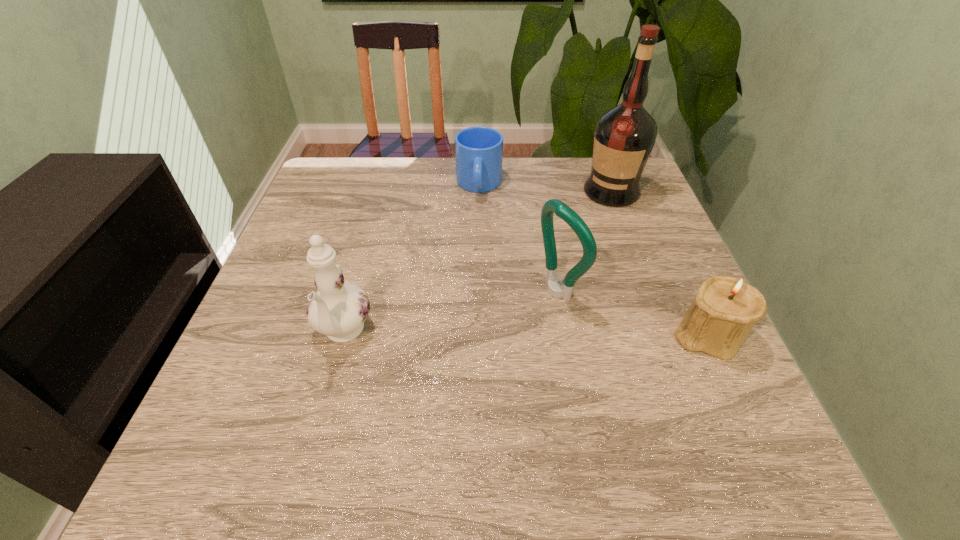
Find the location of a particular element. Image resolution: width=960 pixels, height=540 pixels. free space between the candle_holder and the third object from left to right is located at coordinates (632, 313).

Where is `vacant space that's between the fourth object from right to left and the leftmost object`? The width and height of the screenshot is (960, 540). vacant space that's between the fourth object from right to left and the leftmost object is located at coordinates [411, 259].

What are the coordinates of `unoccupied position between the candle_holder and the chinaware` in the screenshot? It's located at (525, 334).

Locate an element on the screen. free space between the tallest object and the chinaware is located at coordinates (477, 262).

The width and height of the screenshot is (960, 540). I want to click on vacant area between the bottle opener and the candle_holder, so click(632, 313).

Find the location of `vacant space in between the tallest object and the shortest object`. vacant space in between the tallest object and the shortest object is located at coordinates click(x=545, y=188).

I want to click on vacant region between the liquor and the chinaware, so pyautogui.click(x=477, y=262).

At what (x,y) coordinates should I click in order to perform the action: click on free spot between the liquor and the candle_holder. Please return your answer as a coordinate pair (x, y). The width and height of the screenshot is (960, 540). Looking at the image, I should click on (659, 263).

Identify which object is located as the second nearest to the chinaware. Please provide its 2D coordinates. Your answer should be formatted as a tuple, i.e. [(x, y)], where the tuple contains the x and y coordinates of a point satisfying the conditions above.

[(478, 150)]

Locate which object ranks in proximity to the third object from left to right. Please provide its 2D coordinates. Your answer should be formatted as a tuple, i.e. [(x, y)], where the tuple contains the x and y coordinates of a point satisfying the conditions above.

[(726, 308)]